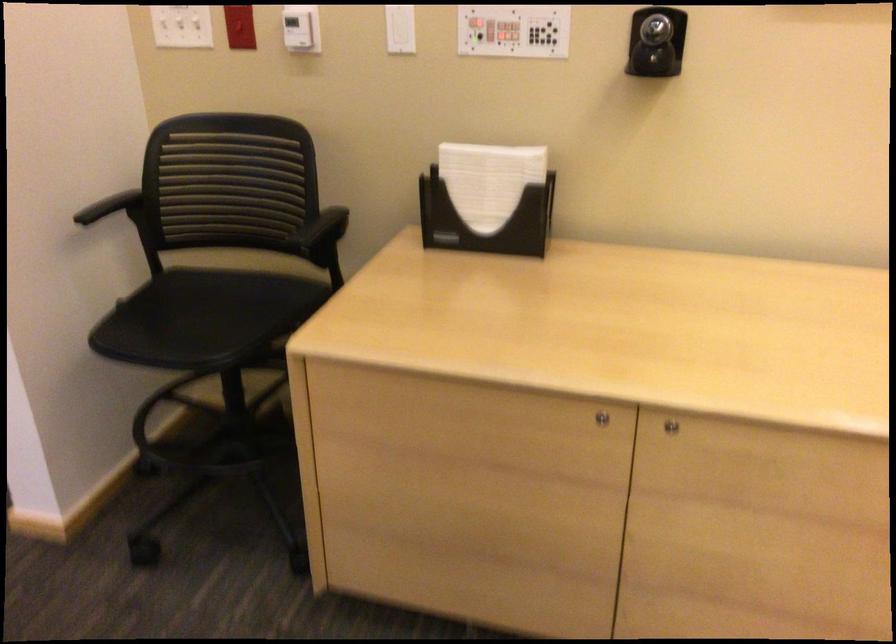
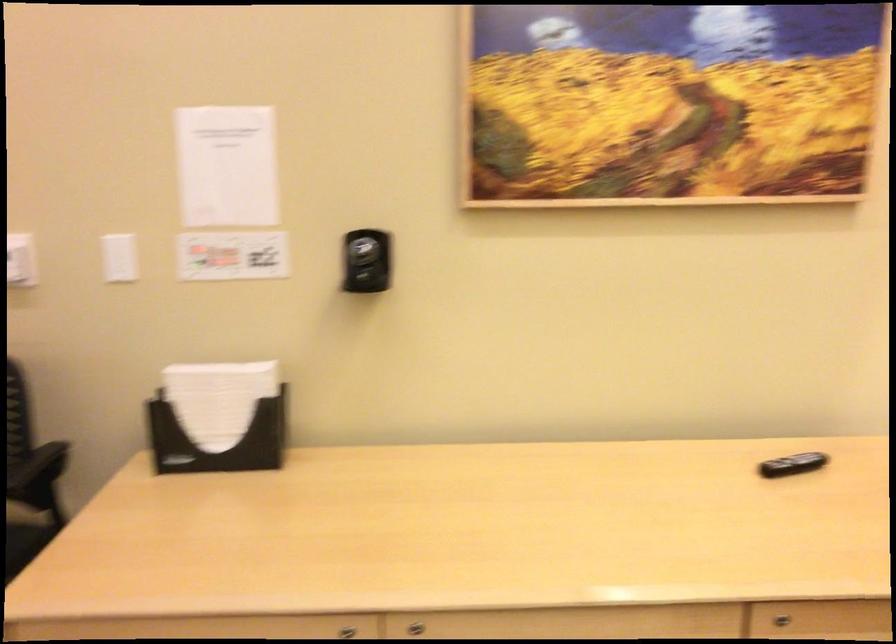
Question: The images are taken continuously from a first-person perspective. In which direction is your viewpoint rotating?

Choices:
 (A) Left
 (B) Right
 (C) Up
 (D) Down

Answer: (B)